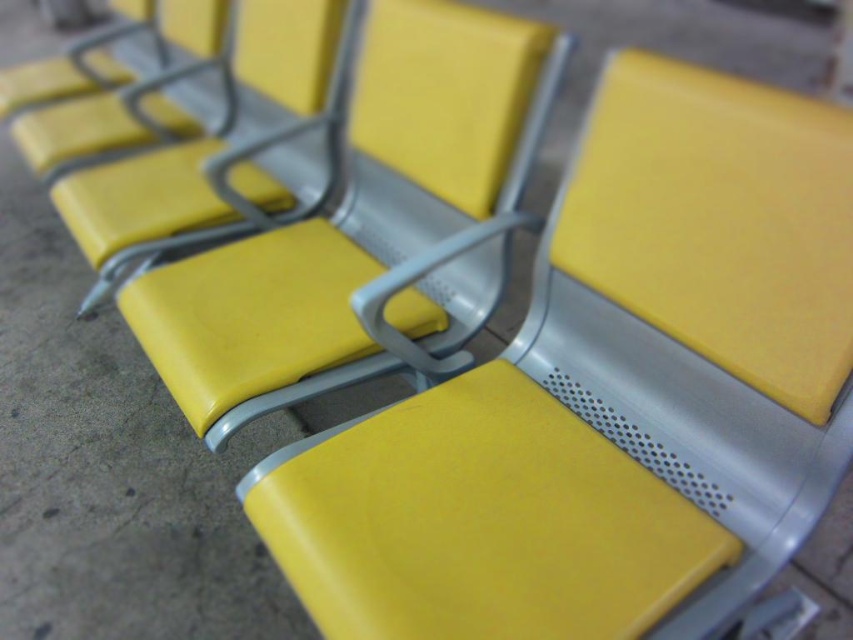
Between point (825, 252) and point (166, 12), which one is positioned in front?

Point (825, 252) is more forward.

Can you confirm if yellow matte seat at center is positioned above matte yellow seat at upper left?

Actually, yellow matte seat at center is below matte yellow seat at upper left.

Image resolution: width=853 pixels, height=640 pixels. What are the coordinates of `yellow matte seat at center` in the screenshot? It's located at (610, 396).

At what (x,y) coordinates should I click in order to perform the action: click on yellow matte seat at center. Please return your answer as a coordinate pair (x, y). Looking at the image, I should click on (610, 396).

Which is below, yellow matte seat at center or matte yellow seat at center?

yellow matte seat at center is below.

Can you confirm if yellow matte seat at center is smaller than matte yellow seat at center?

Indeed, yellow matte seat at center has a smaller size compared to matte yellow seat at center.

Between point (648, 618) and point (378, 118), which one is positioned behind?

Point (378, 118)

Identify the location of yellow matte seat at center. The image size is (853, 640). (610, 396).

Does yellow leather chair at center have a larger size compared to matte yellow seat at upper left?

Yes, yellow leather chair at center is bigger than matte yellow seat at upper left.

Who is more forward, [300,104] or [97,118]?

Point [300,104] is more forward.

Is point (236, 193) positioned before point (136, 131)?

Yes, it is.

You are a GUI agent. You are given a task and a screenshot of the screen. Output one action in this format:
    pyautogui.click(x=<x>, y=<y>)
    Task: Click on the yellow leather chair at center
    
    Given the screenshot: What is the action you would take?
    pyautogui.click(x=160, y=204)